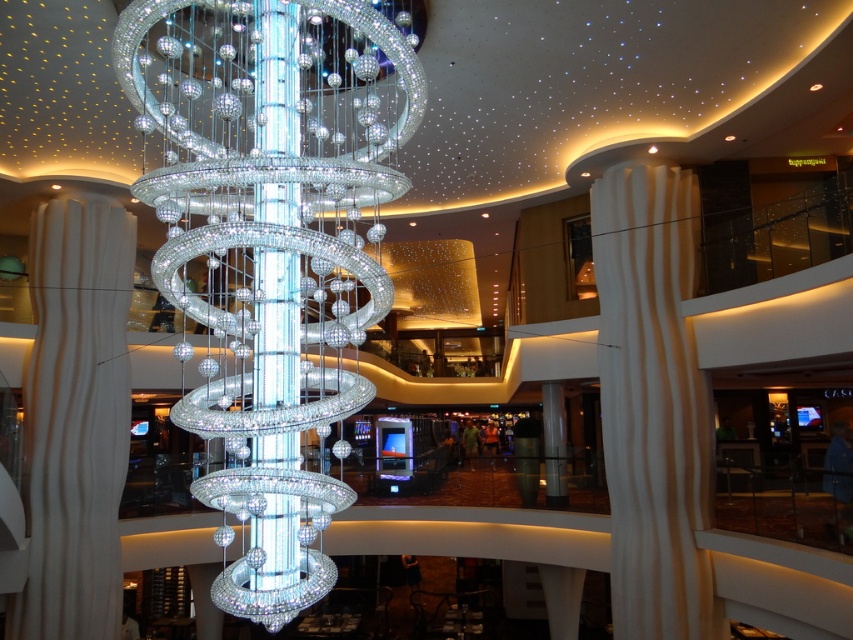
Is point (376, 42) in front of point (668, 298)?

Yes, point (376, 42) is closer to viewer.

Can you confirm if clear crystal chandelier at center is taller than white textured column at center?

No.

Is point (190, 148) positioned before point (660, 561)?

Yes, point (190, 148) is closer to viewer.

Where is `clear crystal chandelier at center`? Image resolution: width=853 pixels, height=640 pixels. clear crystal chandelier at center is located at coordinates (271, 246).